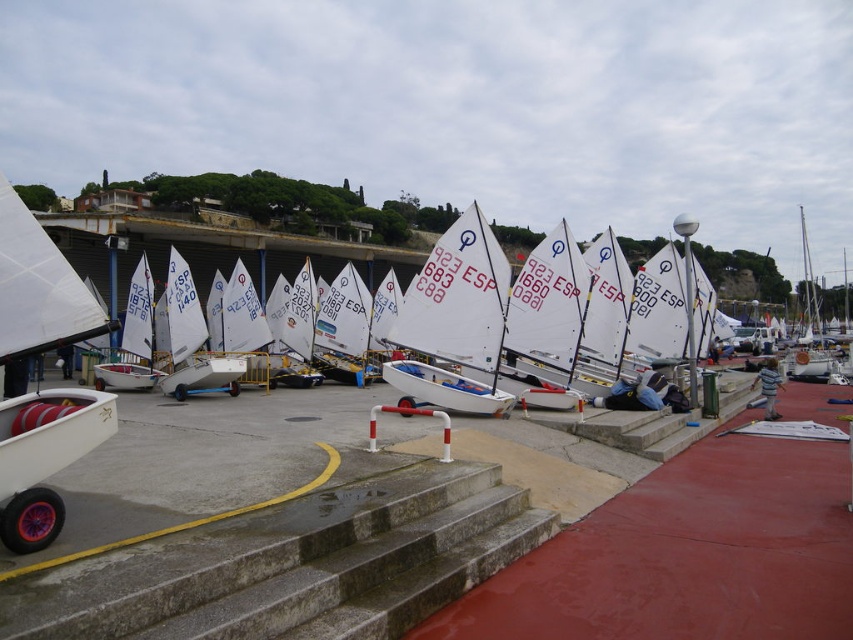
Is concrete steps at center thinner than rubber wheel at lower left?

In fact, concrete steps at center might be wider than rubber wheel at lower left.

Who is higher up, concrete steps at center or rubber wheel at lower left?

rubber wheel at lower left

Find the location of a particular element. concrete steps at center is located at coordinates (296, 564).

Which is behind, point (251, 532) or point (473, 320)?

Positioned behind is point (473, 320).

Can you confirm if concrete steps at center is positioned to the right of white matte sailboat at center?

Incorrect, concrete steps at center is not on the right side of white matte sailboat at center.

Is point (229, 611) positioned before point (401, 368)?

Yes.

Identify the location of concrete steps at center. (296, 564).

Who is shorter, concrete steps at center or white matte sailboat at left?

With less height is concrete steps at center.

Is concrete steps at center to the left of white matte sailboat at left from the viewer's perspective?

In fact, concrete steps at center is to the right of white matte sailboat at left.

Is point (268, 580) positioned in front of point (68, 458)?

Yes, it is.

Identify the location of concrete steps at center. (296, 564).